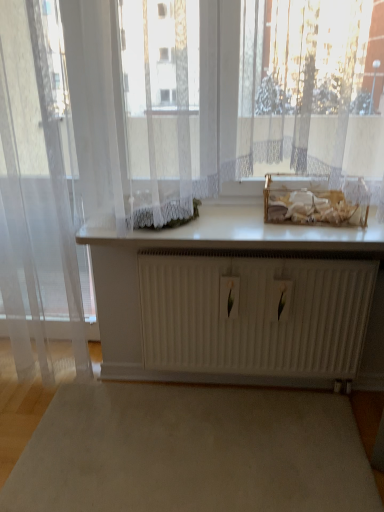
Locate an element on the screen. This screenshot has height=512, width=384. free space on the front side of white matte radiator at center is located at coordinates (265, 447).